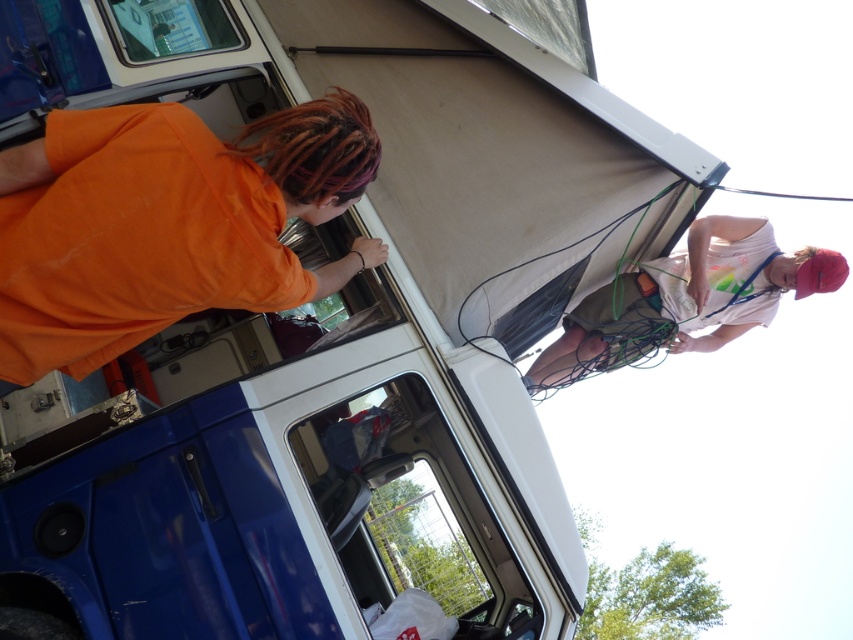
Question: Is orange cotton shirt at left bigger than white cotton shirt at upper right?

Choices:
 (A) yes
 (B) no

Answer: (A)

Question: Is orange cotton shirt at left to the left of white cotton shirt at upper right from the viewer's perspective?

Choices:
 (A) no
 (B) yes

Answer: (B)

Question: Can you confirm if orange cotton shirt at left is smaller than white cotton shirt at upper right?

Choices:
 (A) yes
 (B) no

Answer: (B)